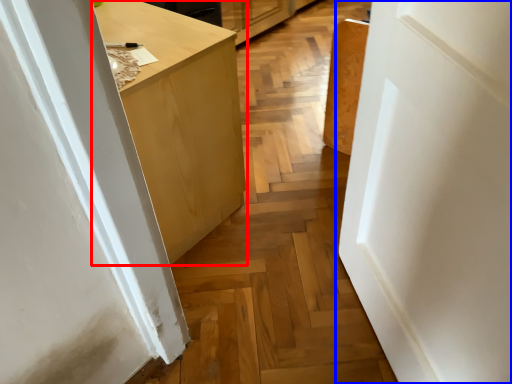
Question: Which object appears farthest to the camera in this image, cabinetry (highlighted by a red box) or door (highlighted by a blue box)?

Choices:
 (A) cabinetry
 (B) door

Answer: (A)